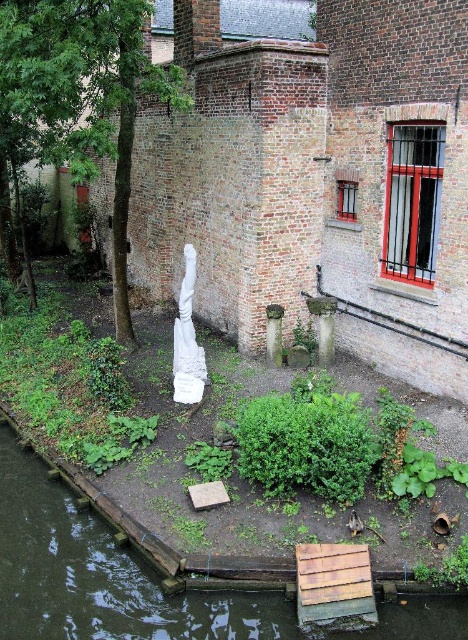
You are standing on the wooden planks at lower center and want to step onto the clear water at dock lower left. Is this possible?

The clear water at dock lower left is much taller than the wooden planks at lower center, so stepping onto it would not be possible as it is deeper and likely unsafe.